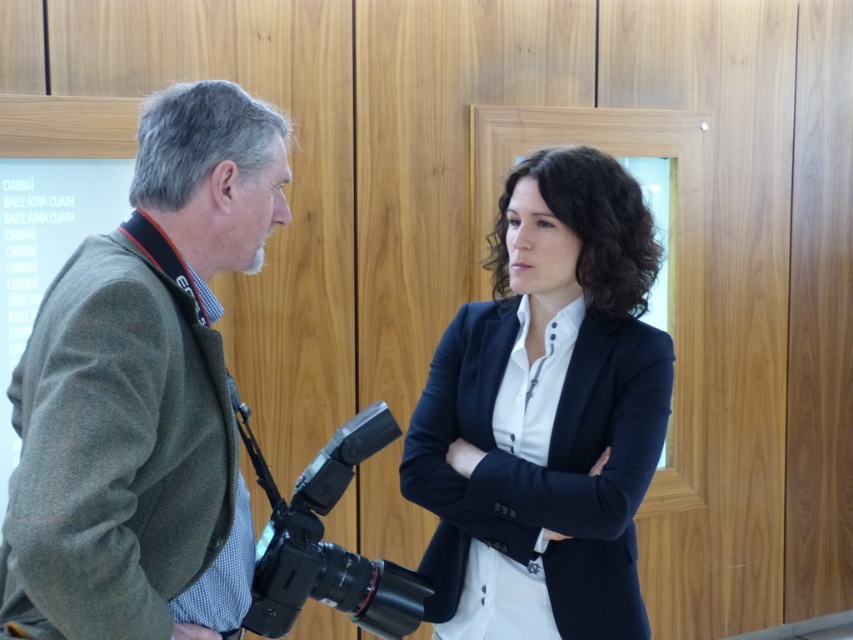
You are a photographer trying to capture a group photo of two people wearing green wool jacket at left and navy blue blazer at center. To ensure both subjects are centered in the frame, which direction should you move the camera?

Since the green wool jacket at left is positioned on the left side of navy blue blazer at center, you should move the camera slightly to the left to center both subjects in the frame.

You are a photographer who needs to adjust your equipment. You have a green wool jacket at left and a black plastic video camera at center. If your camera bag is 25 centimeters wide, can you place both items side by side in it?

The green wool jacket at left is 24.61 centimeters from black plastic video camera at center. Since the distance between them is less than the camera bag width of 25 centimeters, they can be placed side by side in the bag.